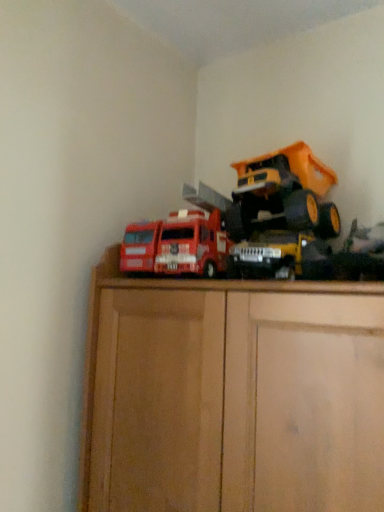
Measure the distance between matte red truck at center, the third toy from the right, and camera.

The distance of matte red truck at center, the third toy from the right, from camera is 37.17 inches.

Where is `matte red truck at center, which is the 1th toy from left to right`? The width and height of the screenshot is (384, 512). matte red truck at center, which is the 1th toy from left to right is located at coordinates (181, 238).

What do you see at coordinates (280, 257) in the screenshot?
I see `metallic yellow truck at center, marked as the 2th toy in a left-to-right arrangement` at bounding box center [280, 257].

Where is `metallic yellow dump truck at upper right, which ranks as the 1th toy in right-to-left order`? metallic yellow dump truck at upper right, which ranks as the 1th toy in right-to-left order is located at coordinates (279, 212).

Where is `matte red truck at center, which is the 1th toy from left to right`? The height and width of the screenshot is (512, 384). matte red truck at center, which is the 1th toy from left to right is located at coordinates (181, 238).

From a real-world perspective, is metallic yellow dump truck at upper right, which appears as the 3th toy when viewed from the left, on matte red truck at center, the third toy from the right?

Indeed, from a real-world perspective, metallic yellow dump truck at upper right, which appears as the 3th toy when viewed from the left, stands above matte red truck at center, the third toy from the right.

Considering the sizes of objects metallic yellow dump truck at upper right, which ranks as the 1th toy in right-to-left order, and matte red truck at center, which is the 1th toy from left to right, in the image provided, who is taller, metallic yellow dump truck at upper right, which ranks as the 1th toy in right-to-left order, or matte red truck at center, which is the 1th toy from left to right,?

Standing taller between the two is metallic yellow dump truck at upper right, which ranks as the 1th toy in right-to-left order.

Could you tell me if metallic yellow dump truck at upper right, which ranks as the 1th toy in right-to-left order, is facing matte red truck at center, which is the 1th toy from left to right?

No.

Is matte red truck at center, the third toy from the right, facing away from metallic yellow truck at center, the 2th toy in the right-to-left sequence?

That's not correct — matte red truck at center, the third toy from the right, is not looking away from metallic yellow truck at center, the 2th toy in the right-to-left sequence.

Is matte red truck at center, which is the 1th toy from left to right, positioned in front of metallic yellow truck at center, marked as the 2th toy in a left-to-right arrangement?

No, the depth of matte red truck at center, which is the 1th toy from left to right, is greater than that of metallic yellow truck at center, marked as the 2th toy in a left-to-right arrangement.

Would you say metallic yellow truck at center, marked as the 2th toy in a left-to-right arrangement, is part of metallic yellow dump truck at upper right, which appears as the 3th toy when viewed from the left,'s contents?

No.

Does metallic yellow dump truck at upper right, which ranks as the 1th toy in right-to-left order, appear on the left side of metallic yellow truck at center, marked as the 2th toy in a left-to-right arrangement?

No.

Between metallic yellow dump truck at upper right, which appears as the 3th toy when viewed from the left, and metallic yellow truck at center, marked as the 2th toy in a left-to-right arrangement, which one has larger size?

metallic yellow dump truck at upper right, which appears as the 3th toy when viewed from the left.

From a real-world perspective, is metallic yellow dump truck at upper right, which ranks as the 1th toy in right-to-left order, positioned above or below metallic yellow truck at center, the 2th toy in the right-to-left sequence?

metallic yellow dump truck at upper right, which ranks as the 1th toy in right-to-left order, is situated higher than metallic yellow truck at center, the 2th toy in the right-to-left sequence, in the real world.

Considering the relative positions of metallic yellow truck at center, marked as the 2th toy in a left-to-right arrangement, and metallic yellow dump truck at upper right, which ranks as the 1th toy in right-to-left order, in the image provided, is metallic yellow truck at center, marked as the 2th toy in a left-to-right arrangement, to the right of metallic yellow dump truck at upper right, which ranks as the 1th toy in right-to-left order, from the viewer's perspective?

Incorrect, metallic yellow truck at center, marked as the 2th toy in a left-to-right arrangement, is not on the right side of metallic yellow dump truck at upper right, which ranks as the 1th toy in right-to-left order.

Considering the relative positions of metallic yellow truck at center, the 2th toy in the right-to-left sequence, and metallic yellow dump truck at upper right, which appears as the 3th toy when viewed from the left, in the image provided, is metallic yellow truck at center, the 2th toy in the right-to-left sequence, behind metallic yellow dump truck at upper right, which appears as the 3th toy when viewed from the left,?

No, metallic yellow truck at center, the 2th toy in the right-to-left sequence, is closer to the viewer.

What's the angular difference between metallic yellow truck at center, the 2th toy in the right-to-left sequence, and metallic yellow dump truck at upper right, which ranks as the 1th toy in right-to-left order,'s facing directions?

3.82 degrees.

Locate an element on the screen. This screenshot has height=512, width=384. toy that is the 1st one when counting downward from the metallic yellow dump truck at upper right, which appears as the 3th toy when viewed from the left (from the image's perspective) is located at coordinates (181, 238).

From the image's perspective, is matte red truck at center, the third toy from the right, under metallic yellow dump truck at upper right, which appears as the 3th toy when viewed from the left?

Correct, matte red truck at center, the third toy from the right, appears lower than metallic yellow dump truck at upper right, which appears as the 3th toy when viewed from the left, in the image.

Looking at this image, is matte red truck at center, which is the 1th toy from left to right, touching metallic yellow dump truck at upper right, which ranks as the 1th toy in right-to-left order?

No, matte red truck at center, which is the 1th toy from left to right, is not next to metallic yellow dump truck at upper right, which ranks as the 1th toy in right-to-left order.

Considering the relative positions of matte red truck at center, the third toy from the right, and metallic yellow dump truck at upper right, which appears as the 3th toy when viewed from the left, in the image provided, is matte red truck at center, the third toy from the right, to the right of metallic yellow dump truck at upper right, which appears as the 3th toy when viewed from the left, from the viewer's perspective?

Incorrect, matte red truck at center, the third toy from the right, is not on the right side of metallic yellow dump truck at upper right, which appears as the 3th toy when viewed from the left.

Is metallic yellow truck at center, the 2th toy in the right-to-left sequence, aimed at matte red truck at center, which is the 1th toy from left to right?

No, metallic yellow truck at center, the 2th toy in the right-to-left sequence, does not turn towards matte red truck at center, which is the 1th toy from left to right.

Does metallic yellow truck at center, the 2th toy in the right-to-left sequence, have a lesser width compared to matte red truck at center, the third toy from the right?

Incorrect, the width of metallic yellow truck at center, the 2th toy in the right-to-left sequence, is not less than that of matte red truck at center, the third toy from the right.

Is metallic yellow truck at center, marked as the 2th toy in a left-to-right arrangement, far from matte red truck at center, which is the 1th toy from left to right?

No.

Looking at this image, can we say metallic yellow truck at center, marked as the 2th toy in a left-to-right arrangement, lies outside matte red truck at center, which is the 1th toy from left to right?

Yes, metallic yellow truck at center, marked as the 2th toy in a left-to-right arrangement, is not within matte red truck at center, which is the 1th toy from left to right.

Find the location of a particular element. The image size is (384, 512). the 2nd toy counting from the right of the matte red truck at center, which is the 1th toy from left to right is located at coordinates (279, 212).

Which toy is the 2nd one when counting from the front of the matte red truck at center, the third toy from the right? Please provide its 2D coordinates.

[(280, 257)]

Looking at the image, which one is located further to matte red truck at center, the third toy from the right, metallic yellow truck at center, the 2th toy in the right-to-left sequence, or metallic yellow dump truck at upper right, which ranks as the 1th toy in right-to-left order?

metallic yellow dump truck at upper right, which ranks as the 1th toy in right-to-left order, is positioned further to the anchor matte red truck at center, the third toy from the right.

Looking at the image, which one is located further to metallic yellow truck at center, marked as the 2th toy in a left-to-right arrangement, metallic yellow dump truck at upper right, which ranks as the 1th toy in right-to-left order, or matte red truck at center, the third toy from the right?

Among the two, matte red truck at center, the third toy from the right, is located further to metallic yellow truck at center, marked as the 2th toy in a left-to-right arrangement.

When comparing their distances from metallic yellow dump truck at upper right, which ranks as the 1th toy in right-to-left order, does metallic yellow truck at center, marked as the 2th toy in a left-to-right arrangement, or matte red truck at center, which is the 1th toy from left to right, seem closer?

metallic yellow truck at center, marked as the 2th toy in a left-to-right arrangement, is closer to metallic yellow dump truck at upper right, which ranks as the 1th toy in right-to-left order.

Based on their spatial positions, is matte red truck at center, which is the 1th toy from left to right, or metallic yellow truck at center, marked as the 2th toy in a left-to-right arrangement, further from metallic yellow dump truck at upper right, which ranks as the 1th toy in right-to-left order?

matte red truck at center, which is the 1th toy from left to right, lies further to metallic yellow dump truck at upper right, which ranks as the 1th toy in right-to-left order, than the other object.

Looking at the image, which one is located further to metallic yellow truck at center, the 2th toy in the right-to-left sequence, matte red truck at center, which is the 1th toy from left to right, or metallic yellow dump truck at upper right, which appears as the 3th toy when viewed from the left?

matte red truck at center, which is the 1th toy from left to right, is further to metallic yellow truck at center, the 2th toy in the right-to-left sequence.

Based on their spatial positions, is metallic yellow dump truck at upper right, which ranks as the 1th toy in right-to-left order, or metallic yellow truck at center, the 2th toy in the right-to-left sequence, further from matte red truck at center, which is the 1th toy from left to right?

Based on the image, metallic yellow dump truck at upper right, which ranks as the 1th toy in right-to-left order, appears to be further to matte red truck at center, which is the 1th toy from left to right.

This screenshot has width=384, height=512. I want to click on toy between matte red truck at center, which is the 1th toy from left to right, and metallic yellow dump truck at upper right, which appears as the 3th toy when viewed from the left, from left to right, so click(280, 257).